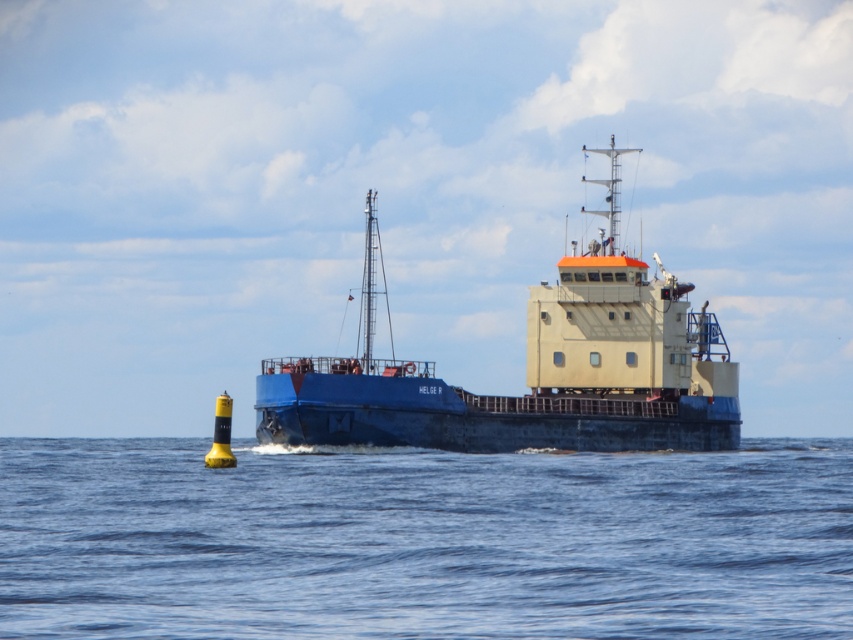
You are standing on the deck of the blue matte ship at center and looking towards the blue water at lower center. Which area takes up more space in your view?

The blue matte ship at center occupies more space than the blue water at lower center in your view.

You are standing on the deck of the blue matte ship at center. Looking down, you see the blue water at lower center. Which object is closer to you?

The blue water at lower center is located below the blue matte ship at center, so it is closer to you when you look downward from the deck of the blue matte ship at center.